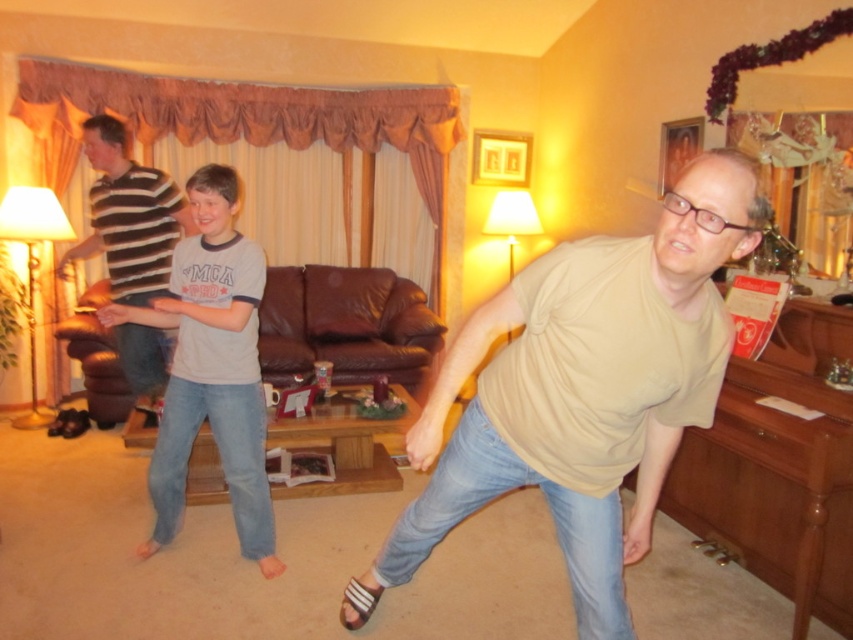
Question: Which object is positioned closest to the striped cotton shirt at left?

Choices:
 (A) matte beige t-shirt at center
 (B) gray cotton shirt at center

Answer: (B)

Question: Which object appears closest to the camera in this image?

Choices:
 (A) striped cotton shirt at left
 (B) matte beige t-shirt at center

Answer: (B)

Question: Does matte beige t-shirt at center appear under gray cotton shirt at center?

Choices:
 (A) yes
 (B) no

Answer: (A)

Question: Can you confirm if matte beige t-shirt at center is bigger than gray cotton shirt at center?

Choices:
 (A) yes
 (B) no

Answer: (A)

Question: Which object is positioned closest to the striped cotton shirt at left?

Choices:
 (A) gray cotton shirt at center
 (B) matte beige t-shirt at center

Answer: (A)

Question: Is matte beige t-shirt at center bigger than striped cotton shirt at left?

Choices:
 (A) no
 (B) yes

Answer: (B)